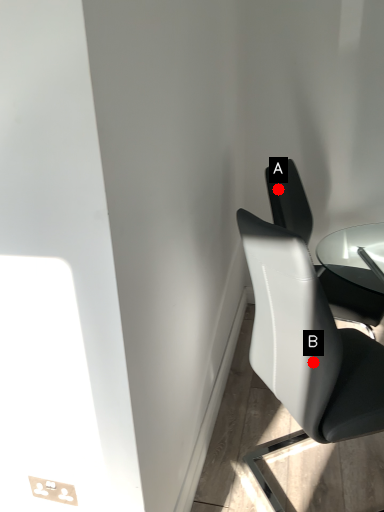
Question: Two points are circled on the image, labeled by A and B beside each circle. Which point is closer to the camera?

Choices:
 (A) A is closer
 (B) B is closer

Answer: (B)